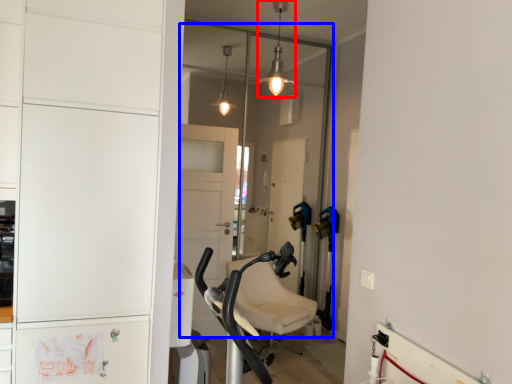
Question: Which point is closer to the camera, light fixture (highlighted by a red box) or glass door (highlighted by a blue box)?

Choices:
 (A) light fixture
 (B) glass door

Answer: (A)